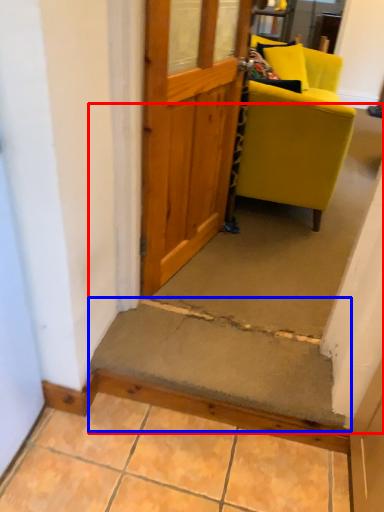
Question: Which object appears farthest to the camera in this image, stairwell (highlighted by a red box) or stairwell (highlighted by a blue box)?

Choices:
 (A) stairwell
 (B) stairwell

Answer: (A)